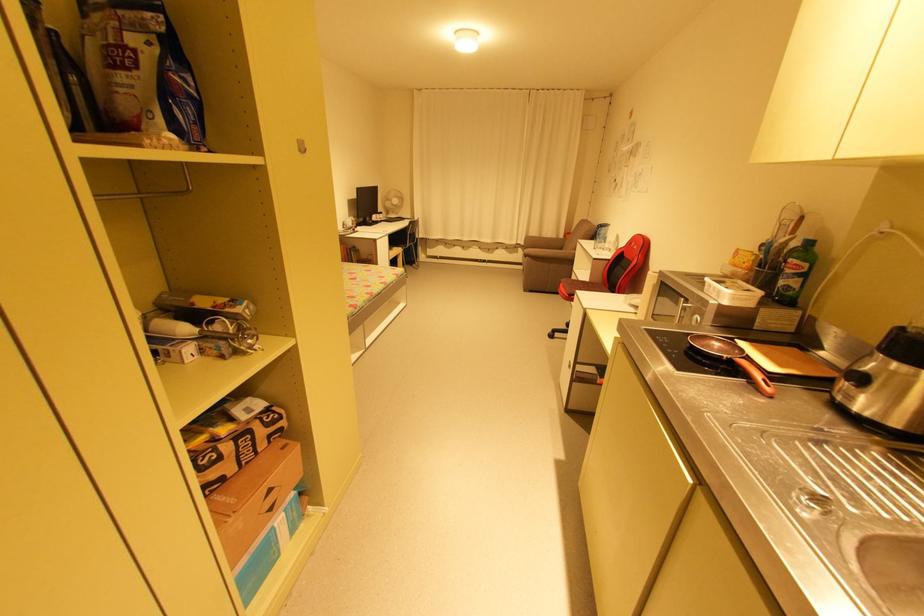
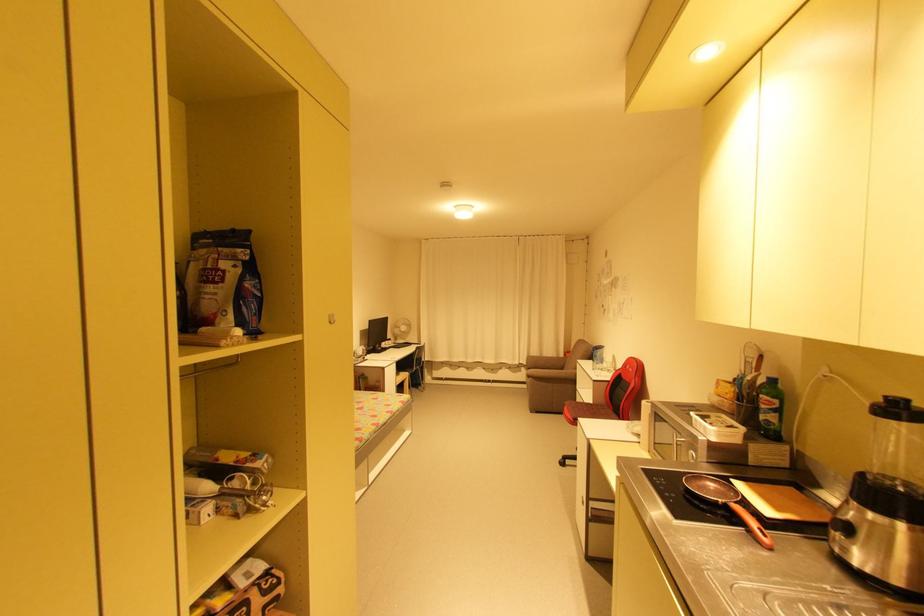
Where in the second image is the point corresponding to (x=539, y=262) from the first image?

(542, 383)